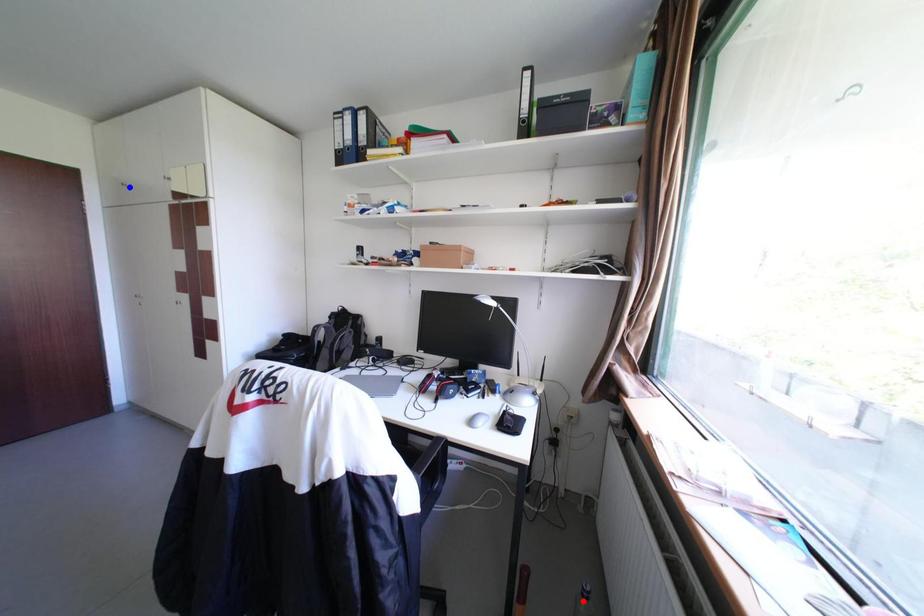
Question: In the image, two points are highlighted. Which point is nearer to the camera? Reply with the corresponding letter.

Choices:
 (A) blue point
 (B) red point

Answer: (B)